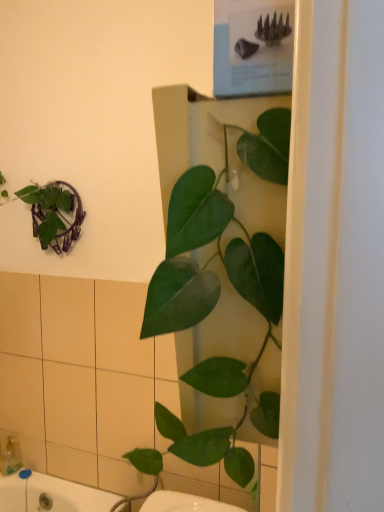
Question: From their relative heights in the image, would you say translucent plastic soap dispenser at lower left is taller or shorter than green glossy leafy plant at center?

Choices:
 (A) short
 (B) tall

Answer: (A)

Question: Do you think translucent plastic soap dispenser at lower left is within green glossy leafy plant at center, or outside of it?

Choices:
 (A) outside
 (B) inside

Answer: (A)

Question: Is translucent plastic soap dispenser at lower left to the left or to the right of green glossy leafy plant at center in the image?

Choices:
 (A) right
 (B) left

Answer: (B)

Question: Considering the positions of green glossy leafy plant at center and translucent plastic soap dispenser at lower left in the image, is green glossy leafy plant at center taller or shorter than translucent plastic soap dispenser at lower left?

Choices:
 (A) tall
 (B) short

Answer: (A)

Question: Which is correct: green glossy leafy plant at center is inside translucent plastic soap dispenser at lower left, or outside of it?

Choices:
 (A) outside
 (B) inside

Answer: (A)

Question: From a real-world perspective, is green glossy leafy plant at center above or below translucent plastic soap dispenser at lower left?

Choices:
 (A) above
 (B) below

Answer: (A)

Question: From the image's perspective, is green glossy leafy plant at center positioned above or below translucent plastic soap dispenser at lower left?

Choices:
 (A) below
 (B) above

Answer: (B)